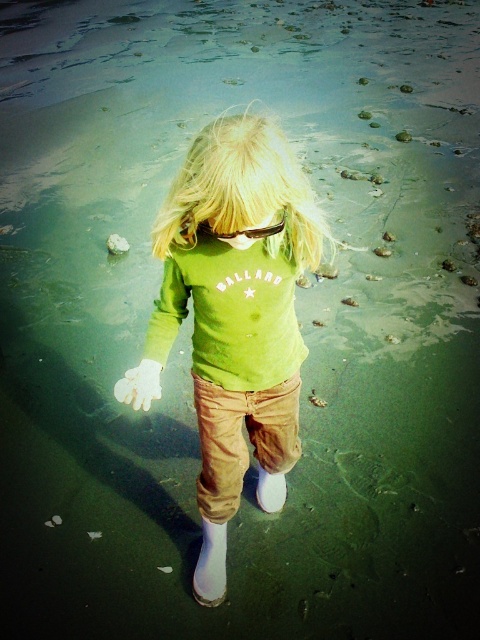
Based on the photo, you are a photographer trying to capture the child in the image. If you want to focus on the blonde hair at center without the green matte shirt at center appearing in the frame, which direction should you move the camera?

Since the green matte shirt at center is to the left of blonde hair at center, you should move the camera to the left to exclude the green matte shirt at center while keeping the blonde hair at center in focus.